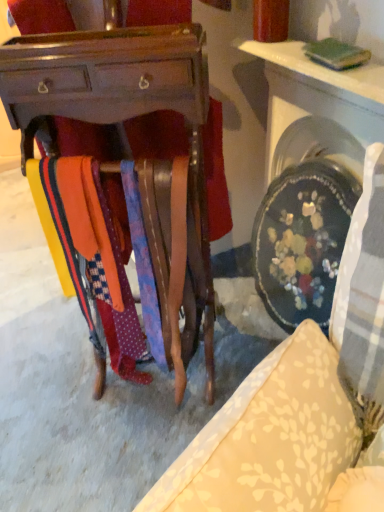
Image resolution: width=384 pixels, height=512 pixels. In order to click on vacant point to the left of orange fabric at center in this screenshot , I will do `click(76, 385)`.